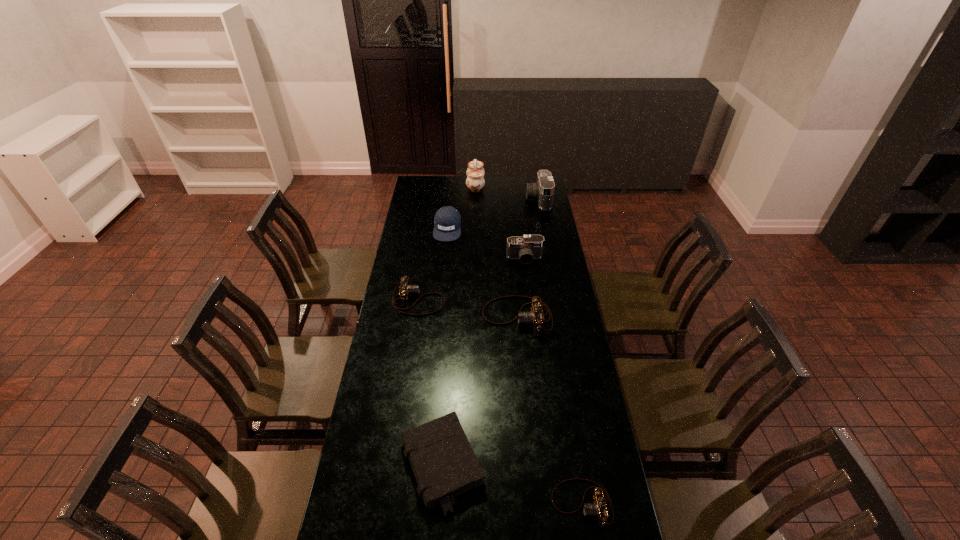
Image resolution: width=960 pixels, height=540 pixels. Find the location of `the leftmost brown camera`. the leftmost brown camera is located at coordinates (405, 289).

This screenshot has height=540, width=960. Find the location of `Bible`. Bible is located at coordinates (443, 462).

Locate an element on the screen. Image resolution: width=960 pixels, height=540 pixels. the nearest brown camera is located at coordinates (597, 509).

Where is `the nearest camera`? Image resolution: width=960 pixels, height=540 pixels. the nearest camera is located at coordinates (597, 509).

This screenshot has height=540, width=960. I want to click on blank space located by the handle of the chinaware, so click(540, 185).

The width and height of the screenshot is (960, 540). I want to click on vacant point located 0.130m on the front-facing side of the farthest camera, so [504, 199].

Locate an element on the screen. vacant area located 0.250m on the front-facing side of the farthest camera is located at coordinates (484, 199).

The height and width of the screenshot is (540, 960). I want to click on vacant point located on the front-facing side of the farthest camera, so click(468, 199).

The height and width of the screenshot is (540, 960). Find the location of `vacant space located 0.240m on the front-facing side of the nearer black camera`. vacant space located 0.240m on the front-facing side of the nearer black camera is located at coordinates (530, 300).

Locate an element on the screen. This screenshot has width=960, height=540. free space located on the front-facing side of the blue baseball cap is located at coordinates (443, 277).